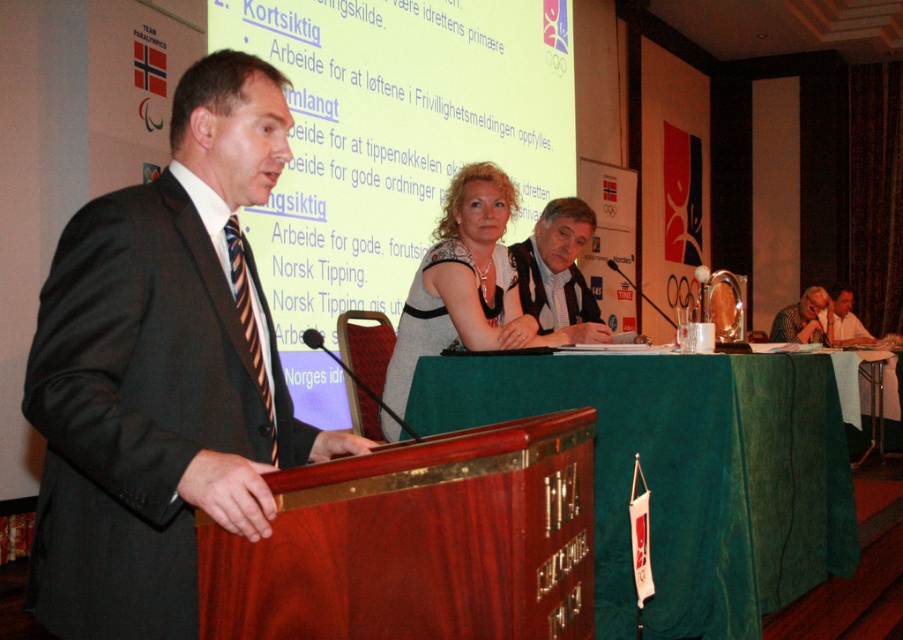
Question: Is gray textured blouse at center thinner than striped fabric tie at left?

Choices:
 (A) no
 (B) yes

Answer: (A)

Question: Is green fabric table at center wider than striped fabric tie at left?

Choices:
 (A) no
 (B) yes

Answer: (B)

Question: Is gray textured blouse at center smaller than striped fabric tie at left?

Choices:
 (A) no
 (B) yes

Answer: (A)

Question: Which is farther from the dark brown suit at left?

Choices:
 (A) striped fabric tie at left
 (B) green fabric table at center
 (C) matte black suit at right

Answer: (C)

Question: Which point is farther to the camera?

Choices:
 (A) green fabric table at center
 (B) dark brown suit at left
 (C) gray textured blouse at center
 (D) striped fabric tie at left

Answer: (C)

Question: Which of the following is the farthest from the observer?

Choices:
 (A) (270, 100)
 (B) (259, 385)

Answer: (A)